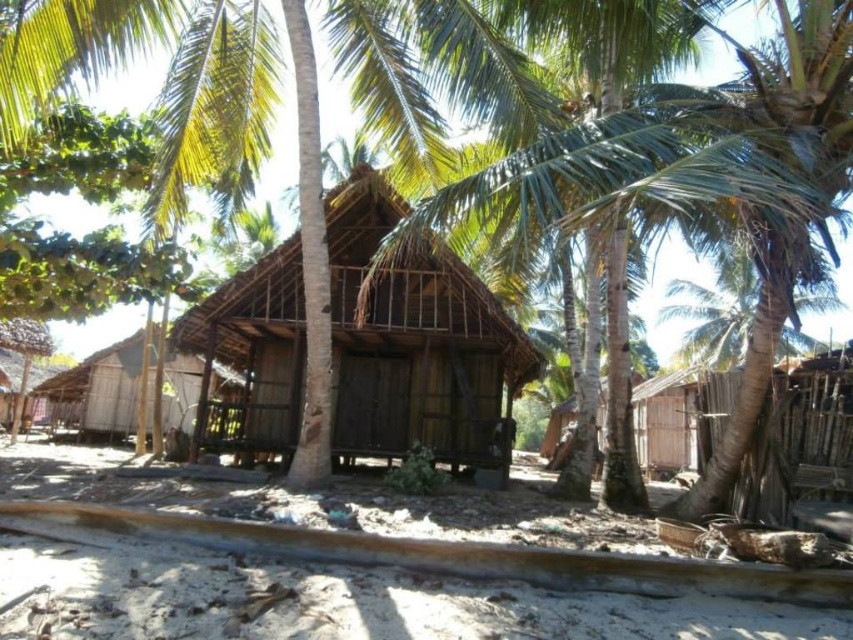
Is smooth sand at lower center positioned at the back of brown wooden hut at center?

No.

Is smooth sand at lower center above brown wooden hut at center?

Incorrect, smooth sand at lower center is not positioned above brown wooden hut at center.

This screenshot has width=853, height=640. Find the location of `smooth sand at lower center`. smooth sand at lower center is located at coordinates (334, 600).

I want to click on smooth sand at lower center, so click(x=334, y=600).

Is wooden thatched roof hut at center to the right of brown wooden hut at center from the viewer's perspective?

Indeed, wooden thatched roof hut at center is positioned on the right side of brown wooden hut at center.

Describe the element at coordinates (415, 340) in the screenshot. The width and height of the screenshot is (853, 640). I see `wooden thatched roof hut at center` at that location.

At what (x,y) coordinates should I click in order to perform the action: click on wooden thatched roof hut at center. Please return your answer as a coordinate pair (x, y). This screenshot has width=853, height=640. Looking at the image, I should click on (415, 340).

Describe the element at coordinates (334, 600) in the screenshot. Image resolution: width=853 pixels, height=640 pixels. I see `smooth sand at lower center` at that location.

Which is in front, point (202, 637) or point (453, 328)?

Point (202, 637) is more forward.

Is point (560, 522) positioned after point (260, 259)?

No, it is in front of (260, 259).

Locate an element on the screen. The height and width of the screenshot is (640, 853). smooth sand at lower center is located at coordinates (334, 600).